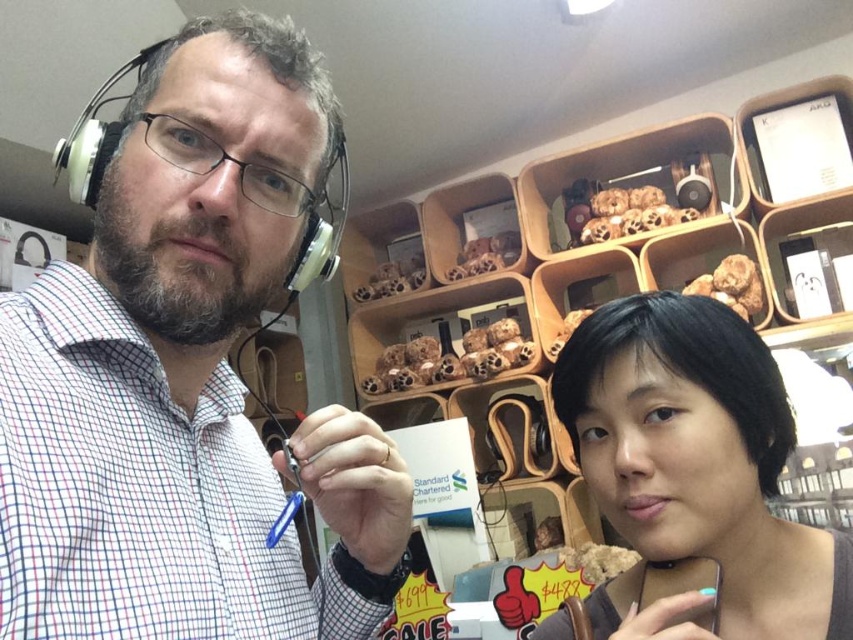
Question: Where is white checkered shirt at left located in relation to black matte hair at center in the image?

Choices:
 (A) right
 (B) left

Answer: (B)

Question: Is white checkered shirt at left positioned before black matte hair at center?

Choices:
 (A) no
 (B) yes

Answer: (B)

Question: Among these points, which one is farthest from the camera?

Choices:
 (A) (181, 536)
 (B) (759, 340)

Answer: (B)

Question: Among these points, which one is farthest from the camera?

Choices:
 (A) (703, 458)
 (B) (202, 108)

Answer: (A)

Question: Is white checkered shirt at left wider than black matte hair at center?

Choices:
 (A) no
 (B) yes

Answer: (B)